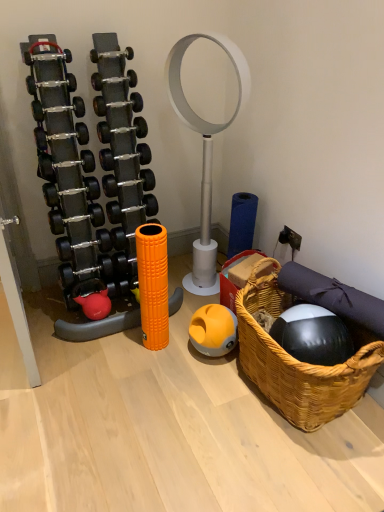
Identify the location of unoccupied area in front of woven brown basket at lower right. The height and width of the screenshot is (512, 384). (293, 468).